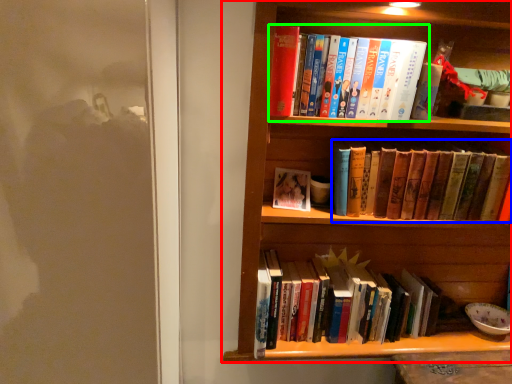
Question: Based on their relative distances, which object is farther from bookcase (highlighted by a red box)? Choose from book (highlighted by a blue box) and book (highlighted by a green box).

Choices:
 (A) book
 (B) book

Answer: (B)